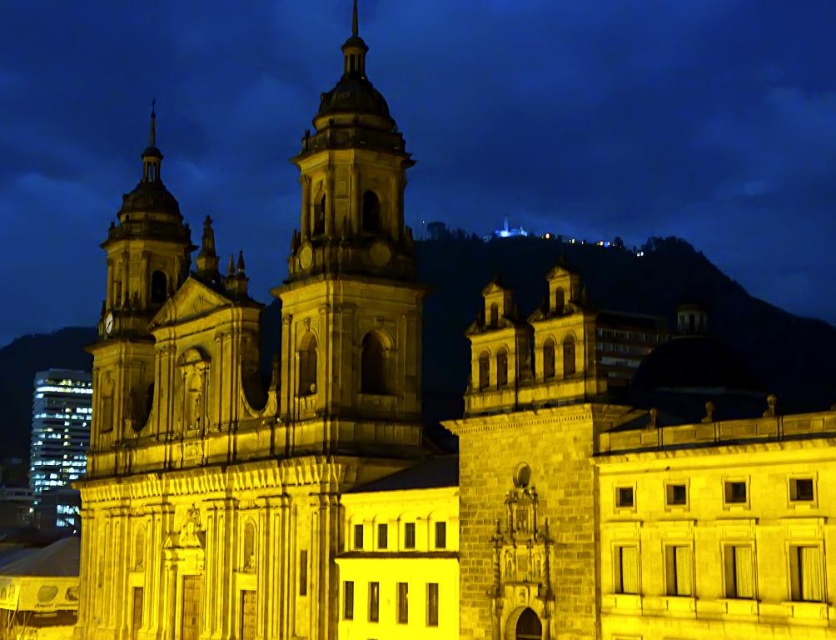
Can you confirm if white stone tower at center is positioned above matte stone bell tower at center?

Actually, white stone tower at center is below matte stone bell tower at center.

Can you confirm if white stone tower at center is bigger than matte stone bell tower at center?

Indeed, white stone tower at center has a larger size compared to matte stone bell tower at center.

Is point (335, 392) behind point (348, 385)?

That is False.

You are a GUI agent. You are given a task and a screenshot of the screen. Output one action in this format:
    pyautogui.click(x=<x>, y=<y>)
    Task: Click on the white stone tower at center
    The image size is (836, 640).
    Given the screenshot: What is the action you would take?
    pyautogui.click(x=248, y=394)